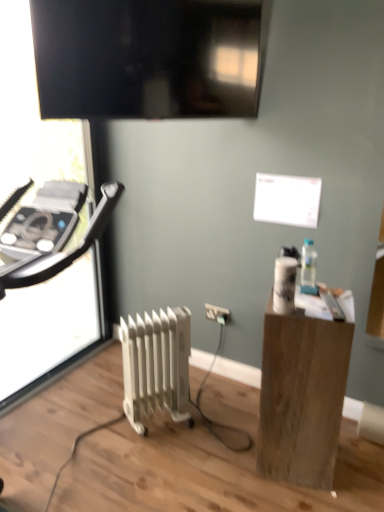
Locate an element on the screen. This screenshot has width=384, height=512. vacant point to the right of white metallic radiator at center is located at coordinates (208, 431).